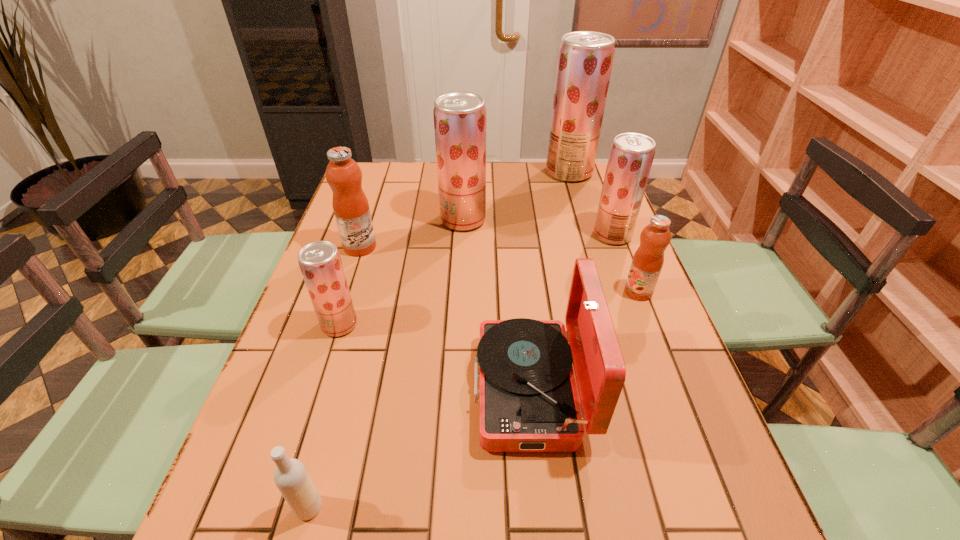
This screenshot has height=540, width=960. In order to click on vacant space at the left edge in this screenshot , I will do `click(253, 423)`.

This screenshot has width=960, height=540. In the image, there is a desktop. In order to click on vacant area at the right edge in this screenshot , I will do `click(638, 394)`.

I want to click on free location at the far left corner of the desktop, so click(x=374, y=169).

Where is `vacant area that lies between the farther orange fruit juice and the phonograph_record`? The image size is (960, 540). vacant area that lies between the farther orange fruit juice and the phonograph_record is located at coordinates click(x=445, y=318).

Where is `vacant space in between the farther orange fruit juice and the leftmost strawberry fruit juice`? The image size is (960, 540). vacant space in between the farther orange fruit juice and the leftmost strawberry fruit juice is located at coordinates pyautogui.click(x=349, y=286).

The height and width of the screenshot is (540, 960). I want to click on empty location between the white vodka and the second tallest fruit juice, so click(386, 363).

The image size is (960, 540). I want to click on free space that is in between the second tallest object and the smallest strawberry fruit juice, so point(401,272).

I want to click on blank region between the white vodka and the second strawberry fruit juice from left to right, so click(386, 363).

The width and height of the screenshot is (960, 540). Identify the location of free space between the farther orange fruit juice and the seventh shortest object. (412, 233).

Identify which object is the fifth nearest to the third biggest strawberry fruit juice. Please provide its 2D coordinates. Your answer should be formatted as a tuple, i.e. [(x, y)], where the tuple contains the x and y coordinates of a point satisfying the conditions above.

[(350, 205)]